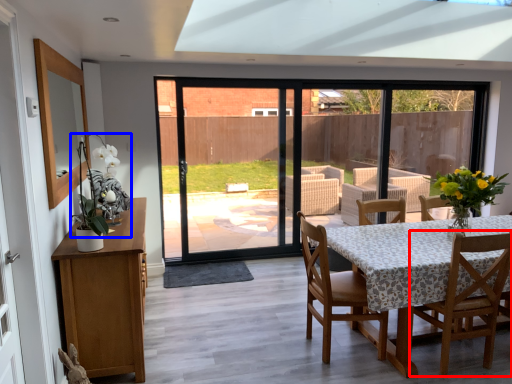
Question: Among these objects, which one is nearest to the camera, chair (highlighted by a red box) or floral arrangement (highlighted by a blue box)?

Choices:
 (A) chair
 (B) floral arrangement

Answer: (B)